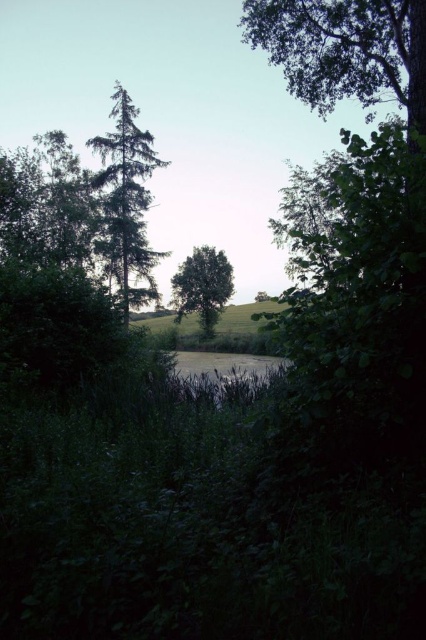
Question: Can you confirm if green matte tree at center is positioned to the left of green leafy tree at center?

Choices:
 (A) yes
 (B) no

Answer: (A)

Question: Does green matte tree at center come behind green leafy tree at center?

Choices:
 (A) yes
 (B) no

Answer: (B)

Question: Does green matte tree at center have a smaller size compared to green leafy tree at center?

Choices:
 (A) no
 (B) yes

Answer: (A)